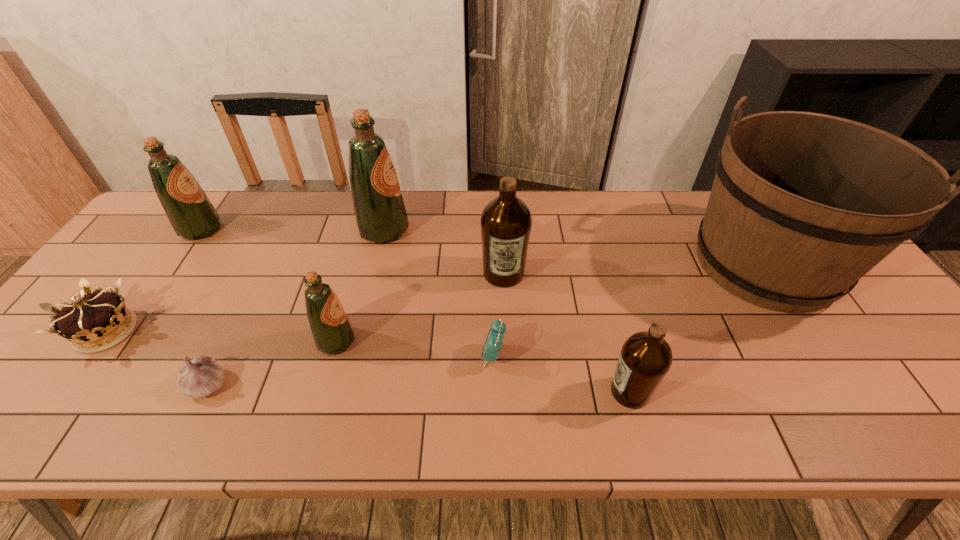
Locate an element on the screen. free location located on the label of the nearer brown olive oil is located at coordinates (493, 392).

You are a GUI agent. You are given a task and a screenshot of the screen. Output one action in this format:
    pyautogui.click(x=<x>, y=<y>)
    Task: Click on the vacant space located 0.330m on the label of the nearer brown olive oil
    
    Given the screenshot: What is the action you would take?
    pyautogui.click(x=457, y=392)

The image size is (960, 540). I want to click on vacant space positioned 0.280m on the back of the gold crown, so click(x=177, y=234).

You are a GUI agent. You are given a task and a screenshot of the screen. Output one action in this format:
    pyautogui.click(x=<x>, y=<y>)
    Task: Click on the free location located 0.290m on the face of the alarm clock
    The width and height of the screenshot is (960, 540).
    Given the screenshot: What is the action you would take?
    pyautogui.click(x=356, y=356)

This screenshot has height=540, width=960. Identify the location of vacant space situated 0.090m on the face of the alarm clock. (443, 356).

Image resolution: width=960 pixels, height=540 pixels. Find the location of `free space located 0.280m on the face of the alarm clock`. free space located 0.280m on the face of the alarm clock is located at coordinates (361, 356).

What are the coordinates of `free location located 0.110m on the right of the garlic` in the screenshot? It's located at click(278, 384).

Image resolution: width=960 pixels, height=540 pixels. Identify the location of bucket that is at the far edge. (803, 205).

You are a GUI agent. You are given a task and a screenshot of the screen. Output one action in this format:
    pyautogui.click(x=<x>, y=<y>)
    Task: Click on the olive oil that is at the near edge
    
    Given the screenshot: What is the action you would take?
    pyautogui.click(x=645, y=358)

I want to click on garlic present at the near edge, so click(202, 376).